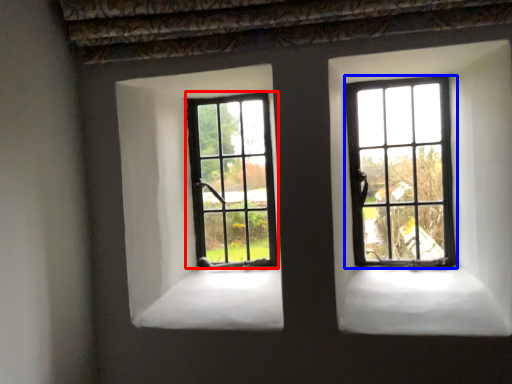
Question: Which point is further to the camera, window (highlighted by a red box) or window (highlighted by a blue box)?

Choices:
 (A) window
 (B) window

Answer: (A)